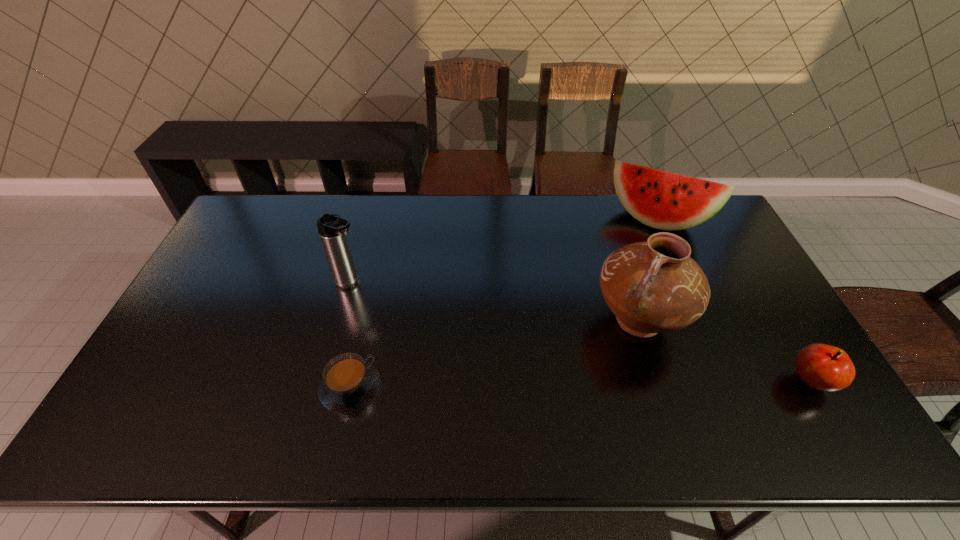
Identify the location of free space located on the handle side of the thermos bottle. (439, 332).

The image size is (960, 540). I want to click on blank area located 0.190m on the outer rind of the watermelon, so click(629, 275).

Image resolution: width=960 pixels, height=540 pixels. I want to click on free location located on the outer rind of the watermelon, so click(x=636, y=258).

This screenshot has height=540, width=960. What are the coordinates of `vacant area situated on the outer rind of the watermelon` in the screenshot? It's located at (627, 279).

Image resolution: width=960 pixels, height=540 pixels. What are the coordinates of `free location located 0.060m on the side of the pottery with the handle` in the screenshot? It's located at (600, 363).

This screenshot has width=960, height=540. Identify the location of free space located 0.170m on the side of the pottery with the handle. (576, 390).

This screenshot has height=540, width=960. Find the location of `free space located on the side of the pottery with the handle`. free space located on the side of the pottery with the handle is located at coordinates (571, 395).

Locate an element on the screen. The image size is (960, 540). object that is at the far edge is located at coordinates (663, 200).

Image resolution: width=960 pixels, height=540 pixels. I want to click on cappuccino situated at the near edge, so click(349, 382).

Image resolution: width=960 pixels, height=540 pixels. What are the coordinates of `apple at the near edge` in the screenshot? It's located at (823, 367).